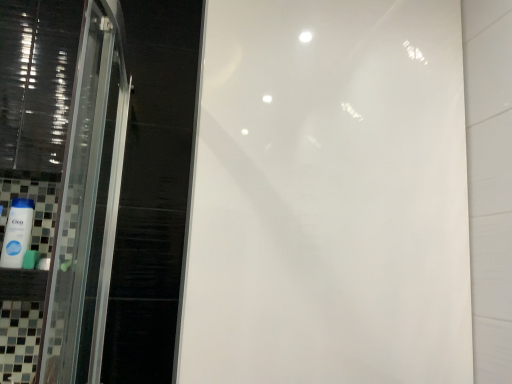
You are a GUI agent. You are given a task and a screenshot of the screen. Output one action in this format:
    pyautogui.click(x=<x>, y=<y>)
    Task: Click on the white glossy mouthwash at lower left
    
    Given the screenshot: What is the action you would take?
    pyautogui.click(x=17, y=233)

What do you see at coordinates (17, 233) in the screenshot? The image size is (512, 384). I see `white glossy mouthwash at lower left` at bounding box center [17, 233].

Describe the element at coordinates (30, 259) in the screenshot. I see `green matte sponge at lower left` at that location.

Identify the location of green matte sponge at lower left. (30, 259).

Find the location of a particular element. The width and height of the screenshot is (512, 384). white glossy mouthwash at lower left is located at coordinates (17, 233).

Considering the relative positions of green matte sponge at lower left and white glossy mouthwash at lower left in the image provided, is green matte sponge at lower left to the left of white glossy mouthwash at lower left from the viewer's perspective?

Incorrect, green matte sponge at lower left is not on the left side of white glossy mouthwash at lower left.

Which object is further away from the camera, green matte sponge at lower left or white glossy mouthwash at lower left?

green matte sponge at lower left is further from the camera.

Does point (27, 264) come behind point (16, 218)?

Yes.

From the image's perspective, which is above, green matte sponge at lower left or white glossy mouthwash at lower left?

white glossy mouthwash at lower left, from the image's perspective.

From a real-world perspective, between green matte sponge at lower left and white glossy mouthwash at lower left, who is vertically lower?

From a 3D spatial view, green matte sponge at lower left is below.

Does green matte sponge at lower left have a greater width compared to white glossy mouthwash at lower left?

Incorrect, the width of green matte sponge at lower left does not surpass that of white glossy mouthwash at lower left.

Between green matte sponge at lower left and white glossy mouthwash at lower left, which one has more height?

white glossy mouthwash at lower left is taller.

In terms of size, does green matte sponge at lower left appear bigger or smaller than white glossy mouthwash at lower left?

Clearly, green matte sponge at lower left is smaller in size than white glossy mouthwash at lower left.

Is green matte sponge at lower left surrounding white glossy mouthwash at lower left?

Definitely not — white glossy mouthwash at lower left is not inside green matte sponge at lower left.

Is green matte sponge at lower left touching white glossy mouthwash at lower left?

Yes, green matte sponge at lower left and white glossy mouthwash at lower left clearly make contact.

Could you tell me if green matte sponge at lower left is turned towards white glossy mouthwash at lower left?

No, green matte sponge at lower left is not turned towards white glossy mouthwash at lower left.

What's the angular difference between green matte sponge at lower left and white glossy mouthwash at lower left's facing directions?

0.0108 degrees separate the facing orientations of green matte sponge at lower left and white glossy mouthwash at lower left.

In the image, there is a white glossy mouthwash at lower left. Find the location of `toiletry below it (from a real-world perspective)`. toiletry below it (from a real-world perspective) is located at coordinates (30, 259).

Based on their positions, is white glossy mouthwash at lower left located to the left or right of green matte sponge at lower left?

white glossy mouthwash at lower left is to the left of green matte sponge at lower left.

Is white glossy mouthwash at lower left closer to camera compared to green matte sponge at lower left?

Yes, white glossy mouthwash at lower left is closer to the camera.

Is point (24, 222) positioned in front of point (24, 267)?

No, it is not.

From the image's perspective, between white glossy mouthwash at lower left and green matte sponge at lower left, which one is located above?

white glossy mouthwash at lower left, from the image's perspective.

From a real-world perspective, is white glossy mouthwash at lower left positioned under green matte sponge at lower left based on gravity?

Incorrect, from a real-world perspective, white glossy mouthwash at lower left is higher than green matte sponge at lower left.

Considering the relative sizes of white glossy mouthwash at lower left and green matte sponge at lower left in the image provided, is white glossy mouthwash at lower left thinner than green matte sponge at lower left?

In fact, white glossy mouthwash at lower left might be wider than green matte sponge at lower left.

Considering the sizes of objects white glossy mouthwash at lower left and green matte sponge at lower left in the image provided, who is shorter, white glossy mouthwash at lower left or green matte sponge at lower left?

green matte sponge at lower left.

Is white glossy mouthwash at lower left smaller than green matte sponge at lower left?

No.

Is white glossy mouthwash at lower left situated inside green matte sponge at lower left or outside?

white glossy mouthwash at lower left is located beyond the bounds of green matte sponge at lower left.

Is white glossy mouthwash at lower left far from green matte sponge at lower left?

No, there isn't a large distance between white glossy mouthwash at lower left and green matte sponge at lower left.

Is white glossy mouthwash at lower left looking in the opposite direction of green matte sponge at lower left?

That's not correct — white glossy mouthwash at lower left is not looking away from green matte sponge at lower left.

How different are the orientations of white glossy mouthwash at lower left and green matte sponge at lower left in degrees?

The angle between the facing direction of white glossy mouthwash at lower left and the facing direction of green matte sponge at lower left is 0.0108 degrees.

The height and width of the screenshot is (384, 512). I want to click on toiletry beneath the white glossy mouthwash at lower left (from a real-world perspective), so click(x=30, y=259).

Identify the location of mouthwash that appears above the green matte sponge at lower left (from a real-world perspective). This screenshot has height=384, width=512. (17, 233).

Locate an element on the screen. The width and height of the screenshot is (512, 384). toiletry located below the white glossy mouthwash at lower left (from the image's perspective) is located at coordinates (30, 259).